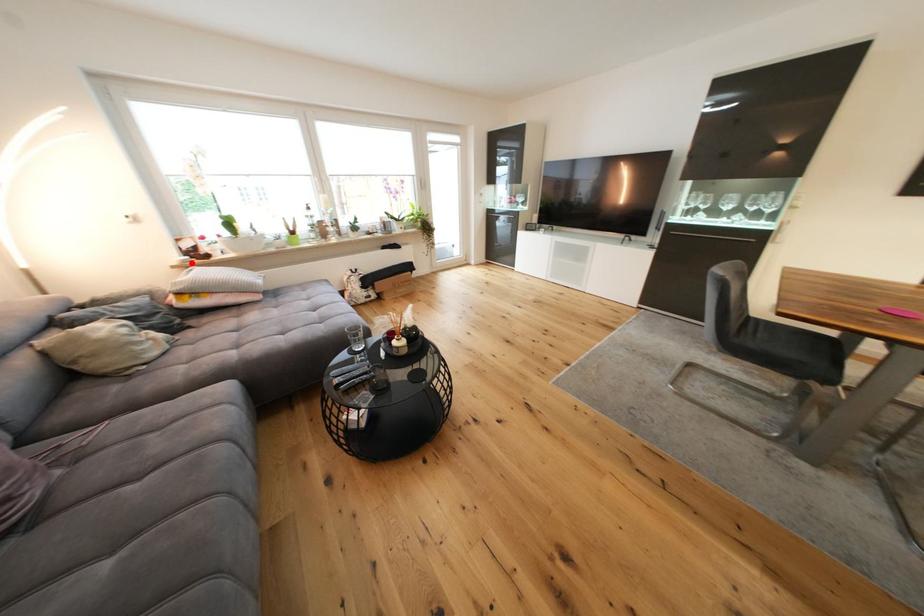
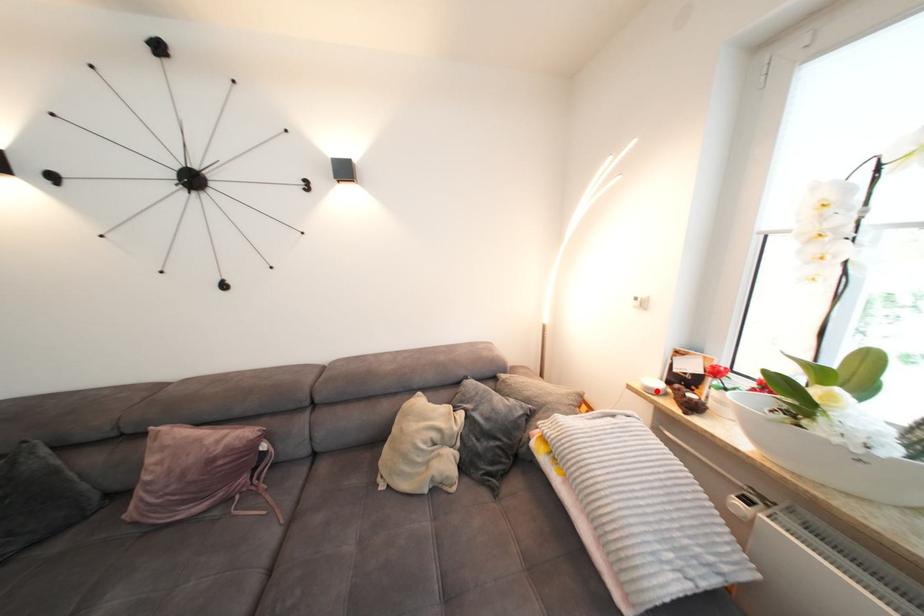
I am providing you with two images of the same scene from different viewpoints. A red point is marked on the first image and another point is marked on the second image. Do the highlighted points in image1 and image2 indicate the same real-world spot?

Yes